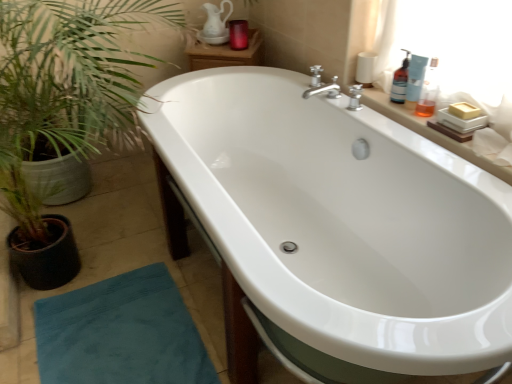
Question: Looking at their shapes, would you say translucent plastic bottle at upper right, placed as the 3th toiletry when sorted from left to right, is wider or thinner than matte glass candle at upper center, the 4th toiletry viewed from the front?

Choices:
 (A) wide
 (B) thin

Answer: (B)

Question: Is translucent plastic bottle at upper right, the 3th toiletry from the back, situated inside matte glass candle at upper center, the first toiletry in the back-to-front sequence, or outside?

Choices:
 (A) outside
 (B) inside

Answer: (A)

Question: Considering the real-world distances, which object is closest to the teal fabric doormat at lower left?

Choices:
 (A) white glossy bathtub at center
 (B) white ceramic soap at upper right
 (C) blue plastic bottle at upper right, the 4th toiletry from the back
 (D) translucent plastic bottle at upper right, the third toiletry from the front
 (E) matte glass candle at upper center, acting as the 1th toiletry starting from the left

Answer: (A)

Question: Estimate the real-world distances between objects in this image. Which object is farther from the matte glass candle at upper center, the first toiletry in the back-to-front sequence?

Choices:
 (A) teal fabric doormat at lower left
 (B) translucent plastic bottle at upper right, the 2th toiletry from the front
 (C) blue plastic bottle at upper right, which is counted as the 1th toiletry, starting from the front
 (D) white ceramic soap at upper right
 (E) translucent plastic bottle at upper right, which appears as the second toiletry when viewed from the back

Answer: (A)